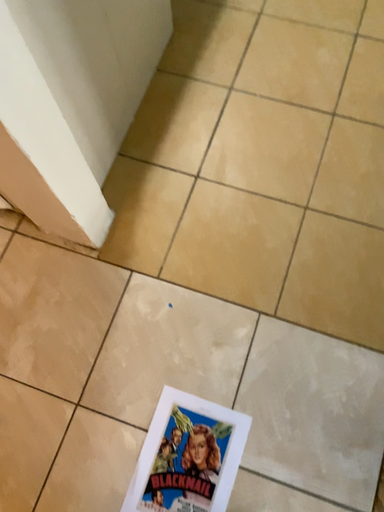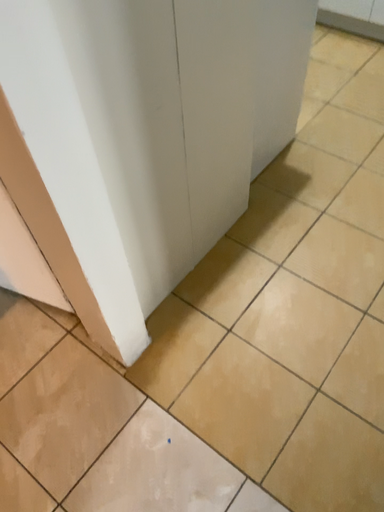
Question: Which way did the camera rotate in the video?

Choices:
 (A) rotated downward
 (B) rotated upward

Answer: (B)